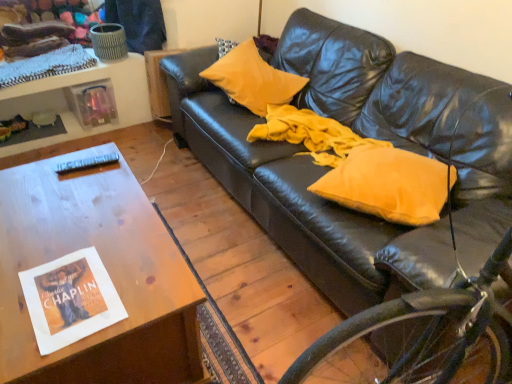
Find the location of a particular element. The width and height of the screenshot is (512, 384). vacant point to the left of white paper magazine at lower left is located at coordinates (12, 273).